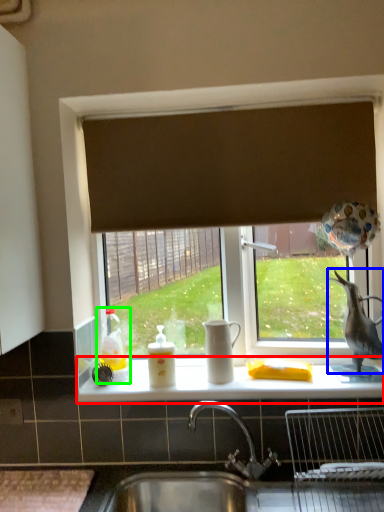
Question: Considering the real-world distances, which object is farthest from counter top (highlighted by a red box)? animal (highlighted by a blue box) or toy (highlighted by a green box)?

Choices:
 (A) animal
 (B) toy

Answer: (A)